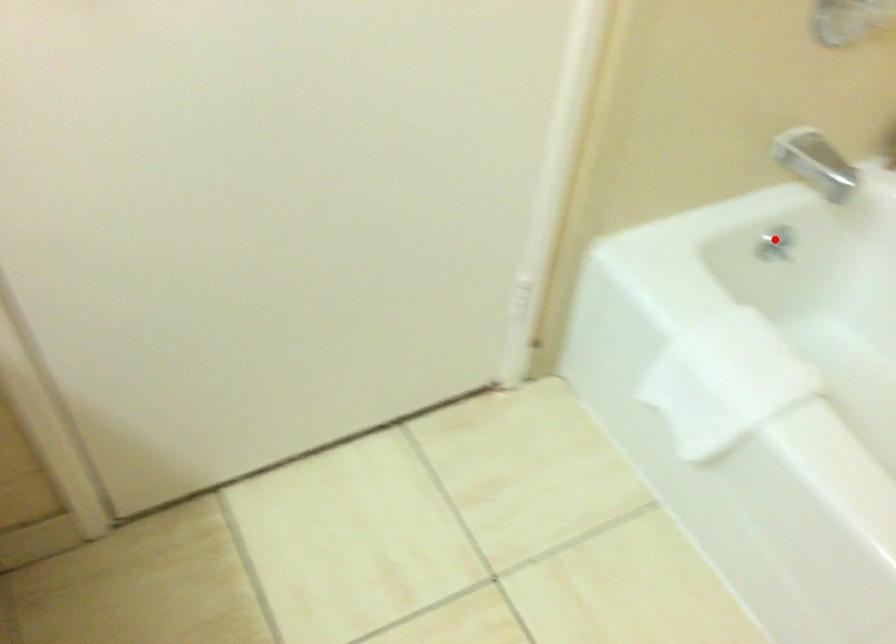
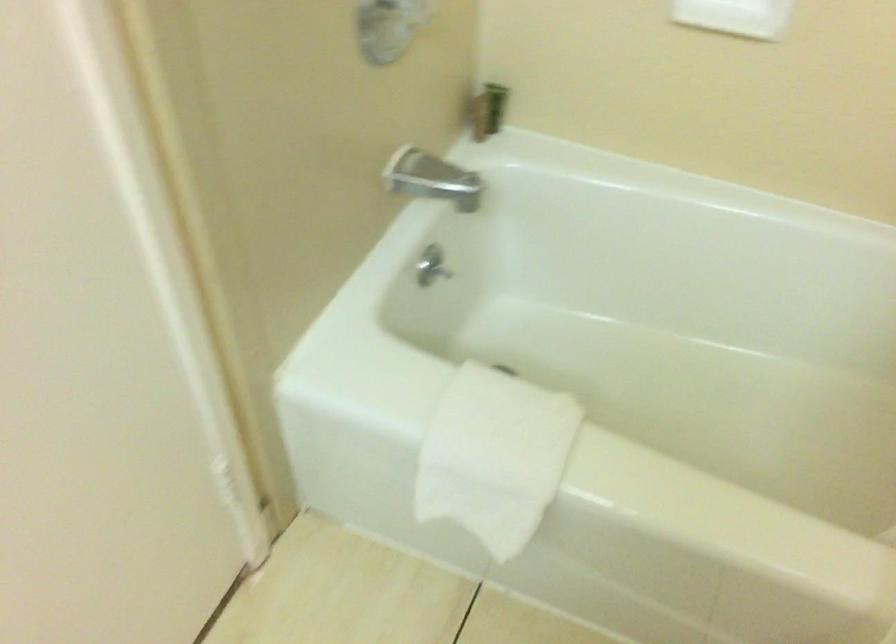
Locate, in the second image, the point that corresponds to the highlighted location in the first image.

(431, 266)